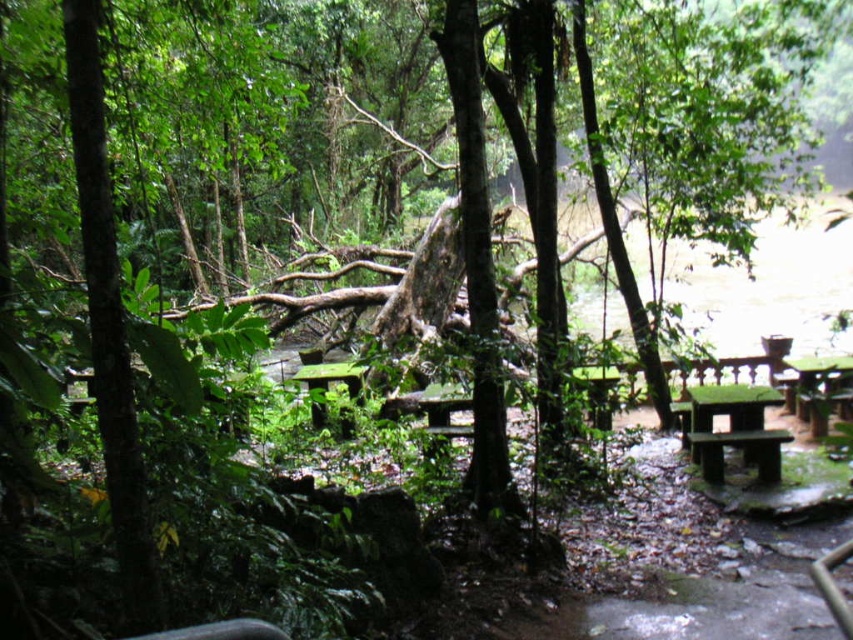
Question: Does green mossy bench at lower right appear over green matte table at right?

Choices:
 (A) yes
 (B) no

Answer: (B)

Question: Can you confirm if green matte table at right is bigger than green matte table at center?

Choices:
 (A) yes
 (B) no

Answer: (B)

Question: Does green mossy bench at lower right appear under green matte table at center?

Choices:
 (A) no
 (B) yes

Answer: (B)

Question: Which point is closer to the camera taking this photo?

Choices:
 (A) tap(347, 433)
 (B) tap(610, 410)

Answer: (B)

Question: Which object is the closest to the green mossy table at center?

Choices:
 (A) green matte table at center
 (B) green matte table at right
 (C) green mossy bench at lower right

Answer: (A)

Question: Which object is closer to the camera taking this photo?

Choices:
 (A) green mossy bench at lower right
 (B) green matte table at center
 (C) green mossy table at center

Answer: (B)